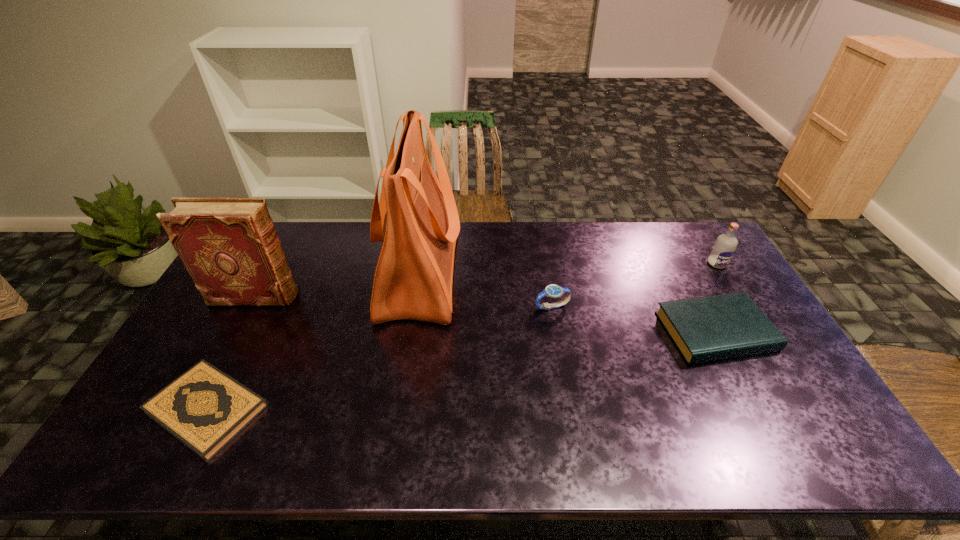
Where is `vacant region located 0.130m on the spine side of the fifth shortest object`? vacant region located 0.130m on the spine side of the fifth shortest object is located at coordinates (338, 296).

Image resolution: width=960 pixels, height=540 pixels. Find the location of `free location located on the label of the vodka`. free location located on the label of the vodka is located at coordinates (743, 306).

Identify the location of vacant space located 0.400m on the front of the fourth tallest object. Image resolution: width=960 pixels, height=540 pixels. (573, 435).

This screenshot has width=960, height=540. Identify the location of blank space located on the left of the rightmost hardback book. (628, 332).

Identify the location of vacant space located 0.240m on the back of the shortest hardback book. This screenshot has height=540, width=960. (262, 303).

Where is `shopping bag that is positioned at the far edge`? The image size is (960, 540). shopping bag that is positioned at the far edge is located at coordinates (416, 218).

You are a GUI agent. You are given a task and a screenshot of the screen. Output one action in this format:
    pyautogui.click(x=<x>, y=<y>)
    Task: Click on the vodka present at the far edge
    The image size is (960, 540).
    Given the screenshot: What is the action you would take?
    pyautogui.click(x=724, y=247)

At what (x,y) coordinates should I click in order to perform the action: click on object present at the near edge. Please return your answer as a coordinate pair (x, y). This screenshot has height=540, width=960. Looking at the image, I should click on (204, 408).

Image resolution: width=960 pixels, height=540 pixels. Find the location of `vodka that is at the right edge`. vodka that is at the right edge is located at coordinates (724, 247).

Identify the location of book present at the right edge. This screenshot has height=540, width=960. [x=710, y=328].